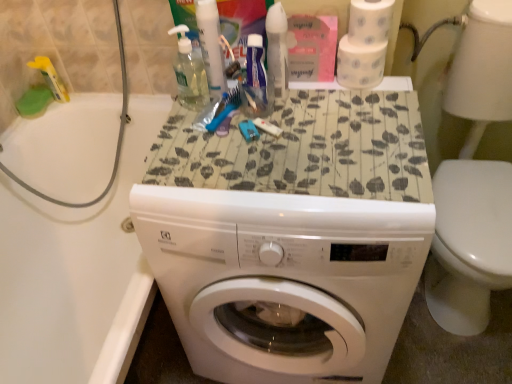
Locate an element on the screen. The image size is (512, 384). empty space that is ontop of white glossy washing machine at center is located at coordinates (285, 142).